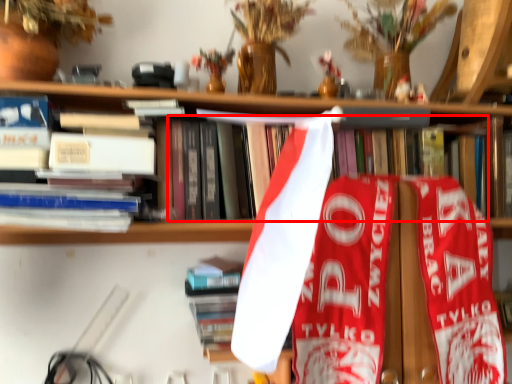
Question: From the image's perspective, considering the relative positions of book (annotated by the red box) and book in the image provided, where is book (annotated by the red box) located with respect to the staircase?

Choices:
 (A) above
 (B) below

Answer: (A)